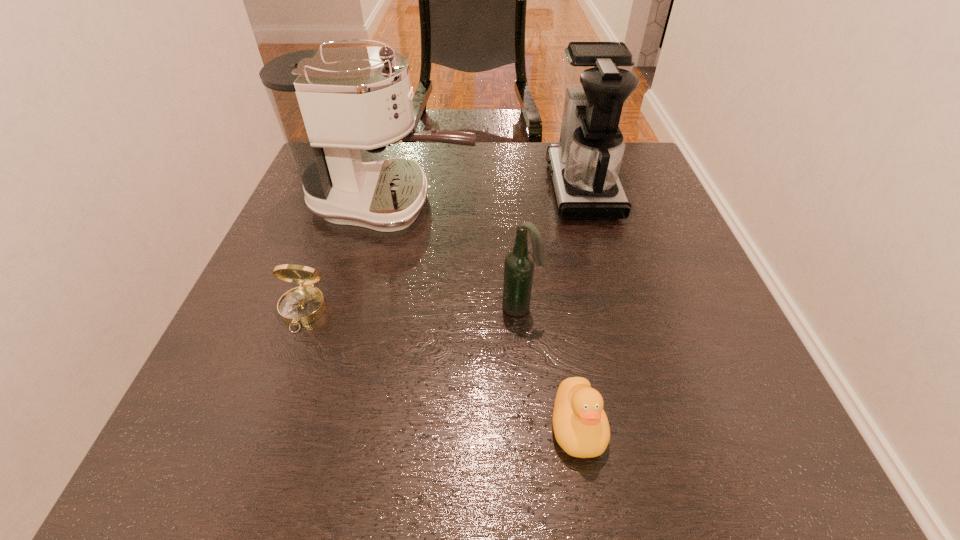
The image size is (960, 540). Find the location of `vacant point at the left edge`. vacant point at the left edge is located at coordinates (293, 396).

The image size is (960, 540). In order to click on free space at the right edge in this screenshot , I will do `click(710, 400)`.

The image size is (960, 540). I want to click on free space at the far right corner of the desktop, so click(657, 181).

You are a GUI agent. You are given a task and a screenshot of the screen. Output one action in this format:
    pyautogui.click(x=<x>, y=<y>)
    Task: Click on the free location at the near right corner
    
    Given the screenshot: What is the action you would take?
    pyautogui.click(x=740, y=467)

Locate an element on the screen. The height and width of the screenshot is (540, 960). free space that is in between the third tallest object and the compass is located at coordinates (412, 309).

At what (x,y) coordinates should I click in order to perform the action: click on free space between the compass and the left coffee maker. Please return your answer as a coordinate pair (x, y). This screenshot has height=540, width=960. Looking at the image, I should click on (348, 257).

Where is `free space between the fourth shortest object and the left coffee maker`? Image resolution: width=960 pixels, height=540 pixels. free space between the fourth shortest object and the left coffee maker is located at coordinates (487, 195).

The height and width of the screenshot is (540, 960). In order to click on free area in between the third shortest object and the right coffee maker in this screenshot , I will do `click(551, 247)`.

Locate an element on the screen. The height and width of the screenshot is (540, 960). free space between the duck and the compass is located at coordinates [x=440, y=368].

I want to click on free space between the left coffee maker and the beer bottle, so click(456, 255).